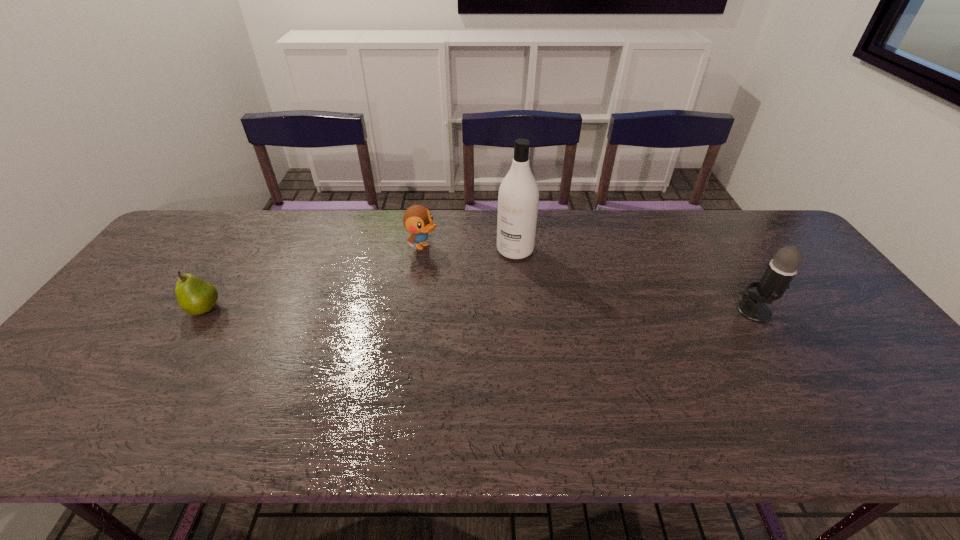
In the image, there is a desktop. Where is `free space at the far left corner`? The width and height of the screenshot is (960, 540). free space at the far left corner is located at coordinates (179, 235).

Identify the location of free area in between the microphone and the duck. The image size is (960, 540). (588, 279).

Locate an element on the screen. vacant region between the microphone and the second object from left to right is located at coordinates (588, 279).

Locate an element on the screen. free spot between the duck and the third object from left to right is located at coordinates (468, 248).

The height and width of the screenshot is (540, 960). I want to click on vacant point located between the leftmost object and the second object from left to right, so click(314, 278).

Where is `free space between the leftmost object and the second tallest object`? The height and width of the screenshot is (540, 960). free space between the leftmost object and the second tallest object is located at coordinates (479, 310).

Find the location of a particular element. The image size is (960, 540). free spot between the shampoo and the microphone is located at coordinates (635, 281).

I want to click on vacant area that lies between the pear and the shampoo, so click(x=360, y=279).

Where is `vacant space that is in between the leftmost object and the rightmost object`? This screenshot has width=960, height=540. vacant space that is in between the leftmost object and the rightmost object is located at coordinates (479, 310).

In order to click on vacant space in between the pear and the rightmost object in this screenshot , I will do `click(479, 310)`.